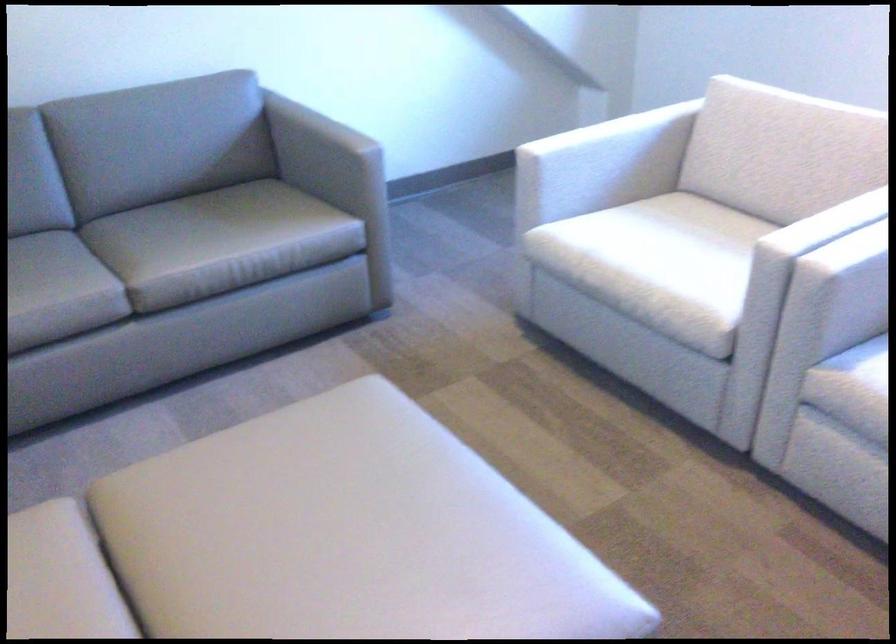
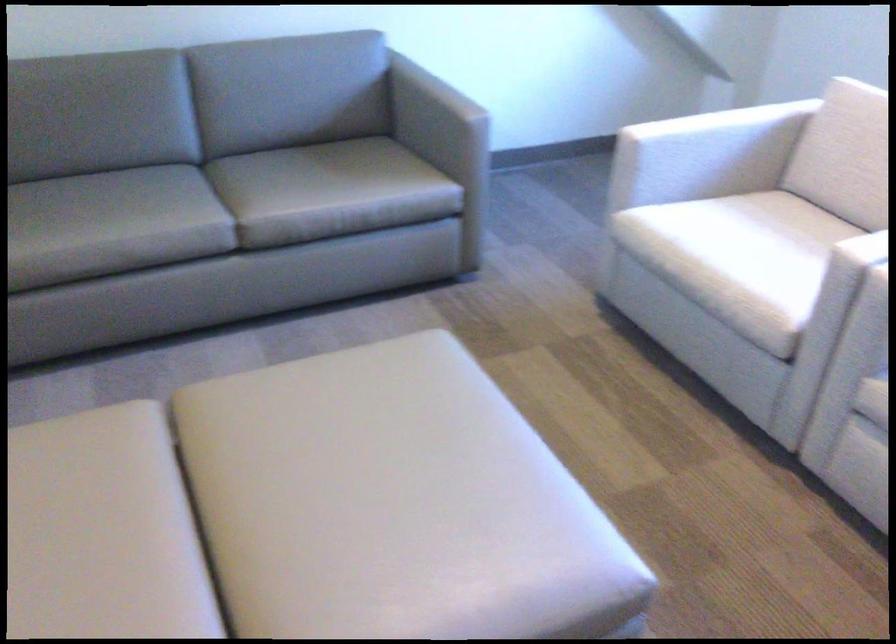
The point at (195, 228) is marked in the first image. Where is the corresponding point in the second image?

(306, 174)